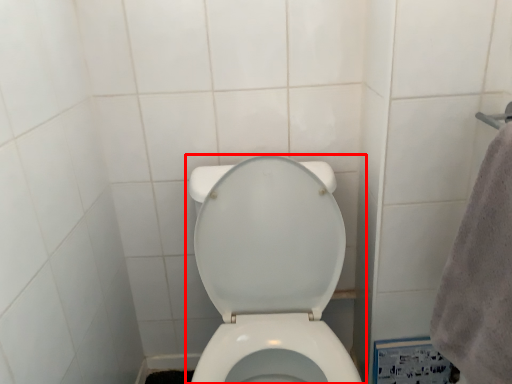
Question: Considering the relative positions of toilet (annotated by the red box) and bath towel in the image provided, where is toilet (annotated by the red box) located with respect to the staircase?

Choices:
 (A) right
 (B) left

Answer: (B)